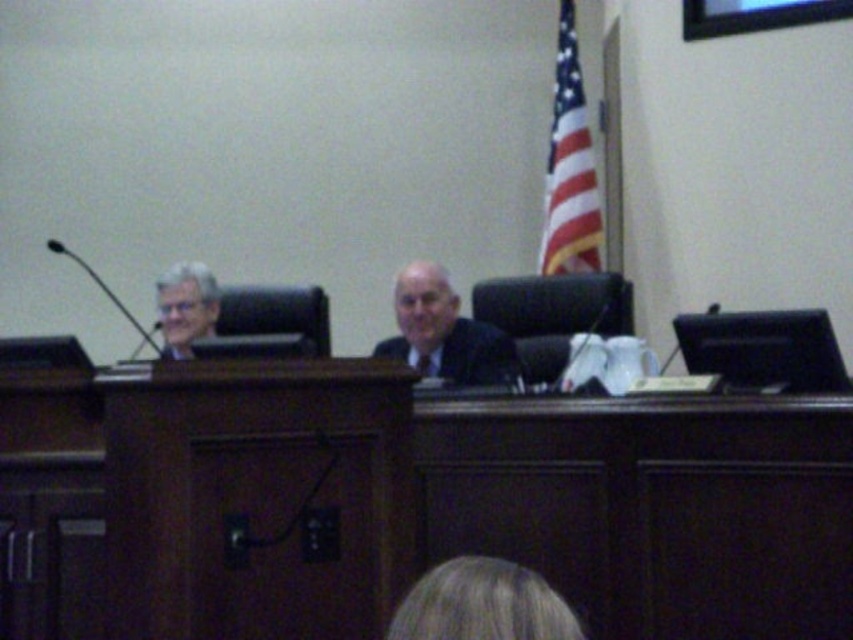
You are an observer in the courtroom scene. You notice the blonde hair at lower center. Can you determine its exact position using the coordinate system provided?

The blonde hair at lower center is located at point (482, 604) in the coordinate system.